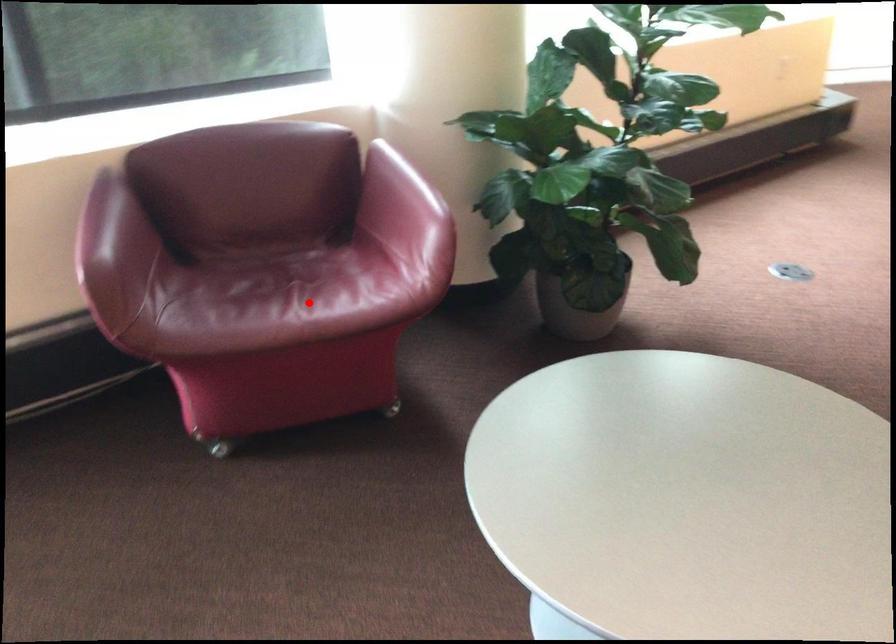
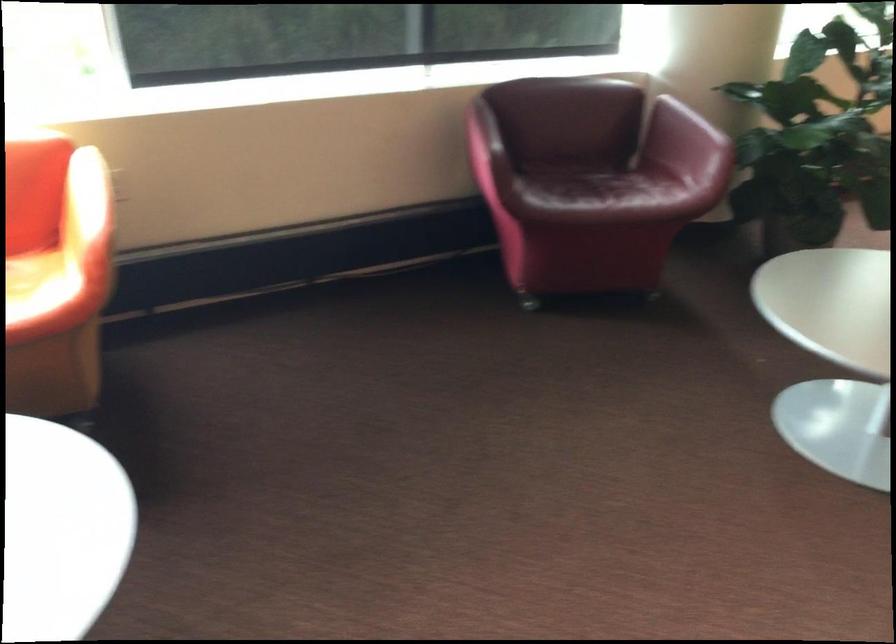
In the second image, find the point that corresponds to the highlighted location in the first image.

(608, 194)